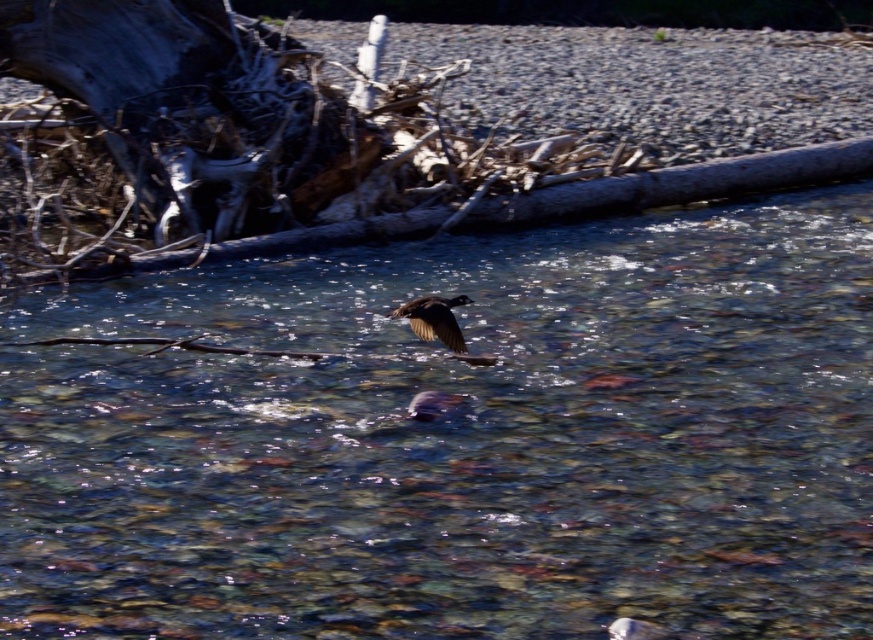
Question: Observing the image, what is the correct spatial positioning of clear water at center in reference to dark brown feathers at center?

Choices:
 (A) left
 (B) right

Answer: (A)

Question: Which object appears closest to the camera in this image?

Choices:
 (A) clear water at center
 (B) dark brown feathers at center

Answer: (A)

Question: Which of the following is the closest to the observer?

Choices:
 (A) clear water at center
 (B) dark brown feathers at center

Answer: (A)

Question: Is clear water at center above dark brown feathers at center?

Choices:
 (A) yes
 (B) no

Answer: (A)

Question: From the image, what is the correct spatial relationship of clear water at center in relation to dark brown feathers at center?

Choices:
 (A) below
 (B) above

Answer: (B)